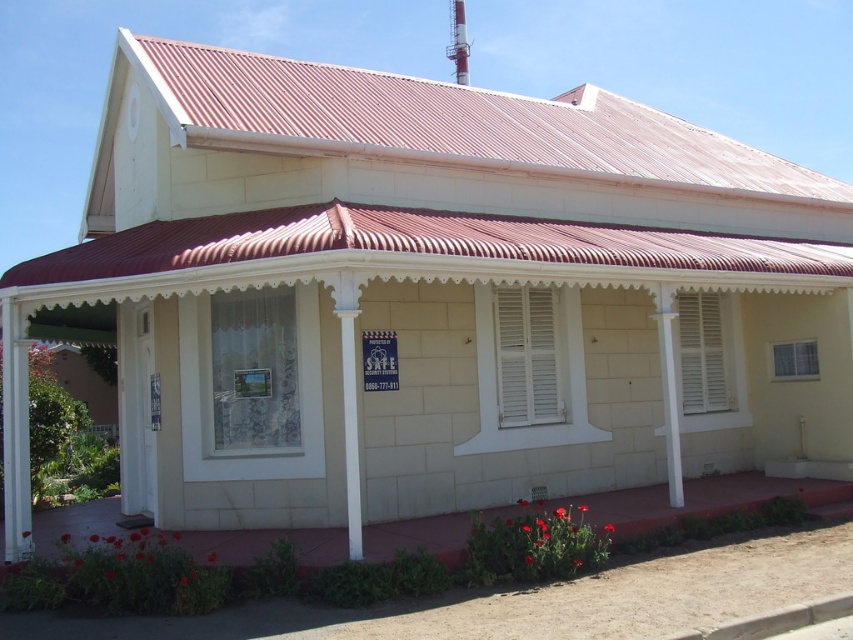
You are standing in front of the building and notice two sets of shutters. The first is a white matte shutter at center, and the second is white wooden shutters at center. Which one is positioned to the left when viewed from the front?

The white matte shutter at center is positioned to the left of the white wooden shutters at center when viewed from the front.

You are standing in front of the building and notice two sets of shutters. The white matte shutter at center and the white wooden shutters at center. Which one is positioned higher?

The white matte shutter at center is located above the white wooden shutters at center, so it is positioned higher.